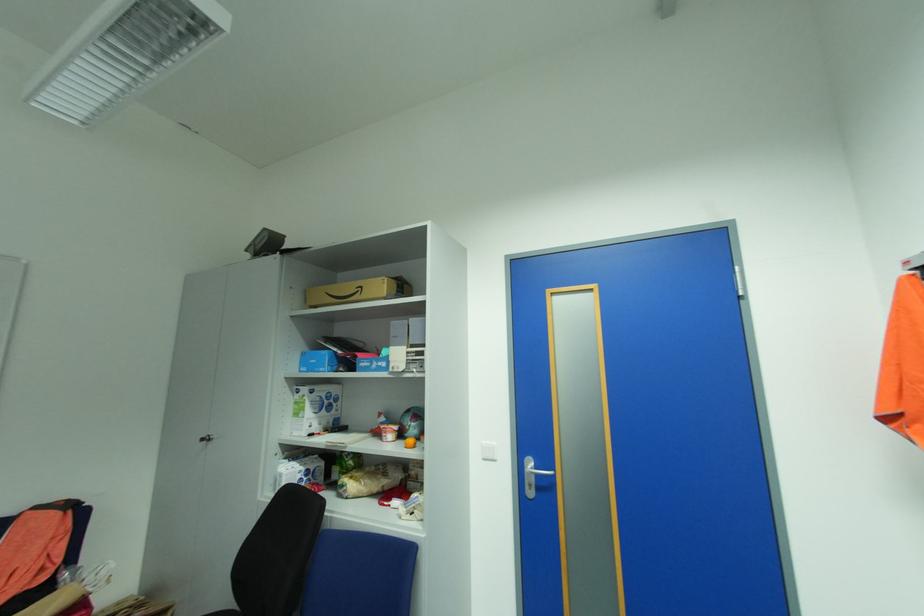
The height and width of the screenshot is (616, 924). I want to click on white light switch, so click(489, 453).